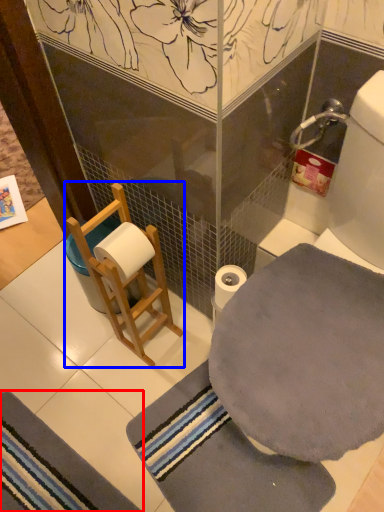
Question: Which of the following is the closest to the observer, bath mat (highlighted by a red box) or armchair (highlighted by a blue box)?

Choices:
 (A) bath mat
 (B) armchair

Answer: (B)